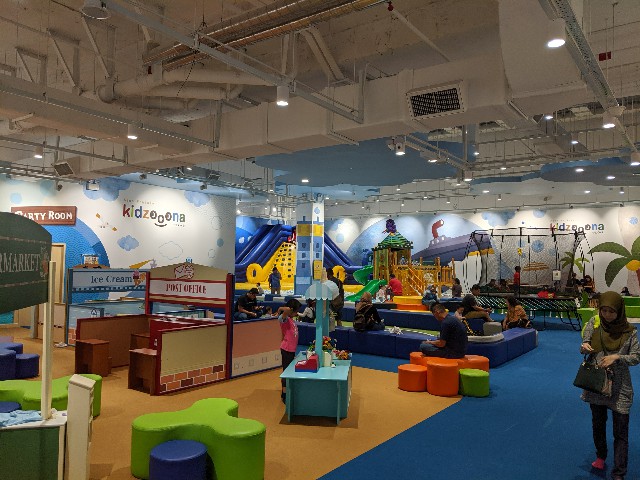
I want to click on table, so click(187, 424), click(57, 394).